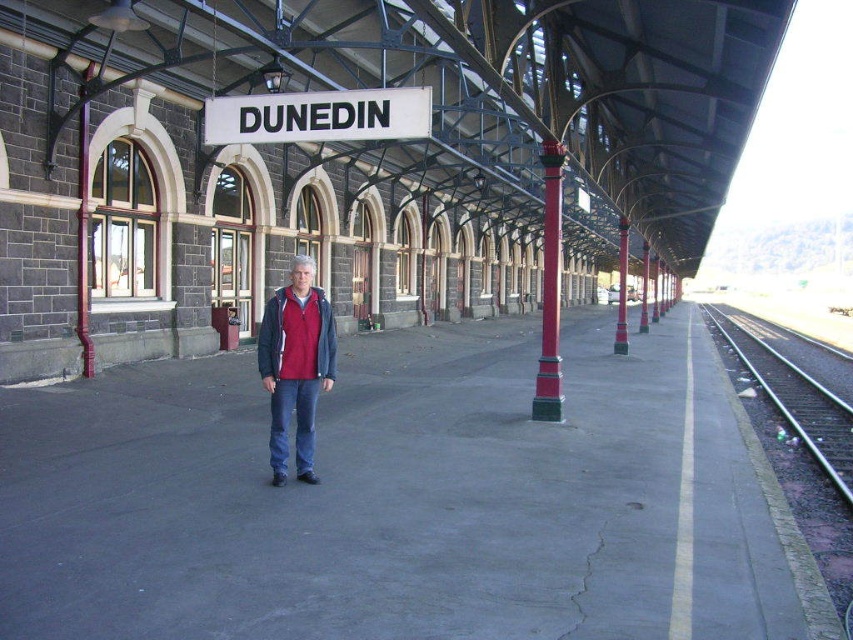
Does white plastic sign at upper center have a smaller size compared to red fleece jacket at center?

Yes, white plastic sign at upper center is smaller than red fleece jacket at center.

Can you confirm if white plastic sign at upper center is positioned to the right of red fleece jacket at center?

Indeed, white plastic sign at upper center is positioned on the right side of red fleece jacket at center.

Describe the element at coordinates (318, 116) in the screenshot. The image size is (853, 640). I see `white plastic sign at upper center` at that location.

Identify the location of white plastic sign at upper center. (318, 116).

Who is more distant from viewer, (279, 467) or (741, 330)?

The point (741, 330) is more distant.

Between matte red jacket at center and black asphalt train track at right, which one appears on the right side from the viewer's perspective?

Positioned to the right is black asphalt train track at right.

Is point (285, 420) positioned in front of point (804, 419)?

Yes, it is.

Where is `matte red jacket at center`? matte red jacket at center is located at coordinates (294, 365).

Who is positioned more to the left, matte red jacket at center or red painted metal pole at center?

Positioned to the left is matte red jacket at center.

Is matte red jacket at center further to camera compared to red painted metal pole at center?

No.

Locate an element on the screen. matte red jacket at center is located at coordinates point(294,365).